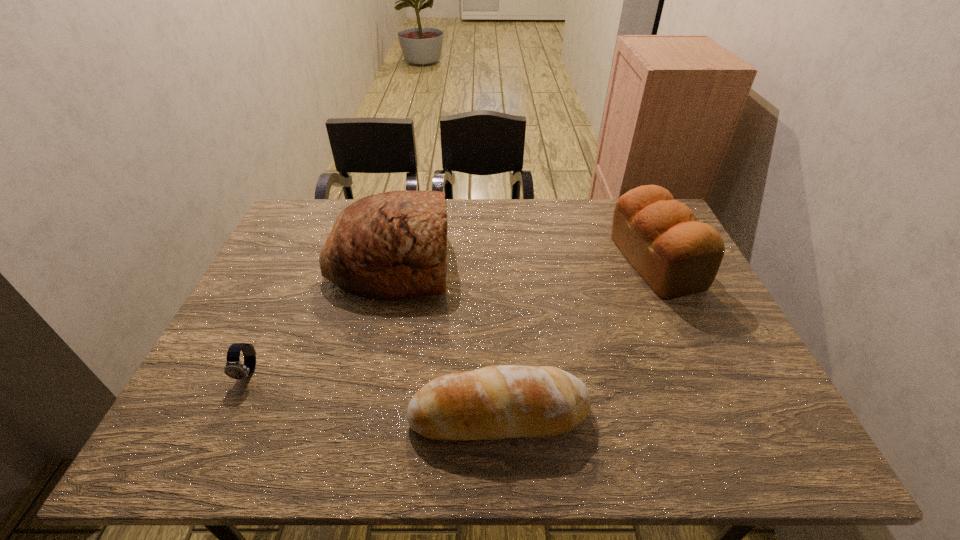
Where is `the rightmost bread`? This screenshot has height=540, width=960. the rightmost bread is located at coordinates (677, 256).

Where is `the second shortest object`? the second shortest object is located at coordinates (497, 402).

Where is `the nearest bread`? The image size is (960, 540). the nearest bread is located at coordinates (497, 402).

Identify the location of the leftmost object. (234, 369).

Locate an element on the screen. the shortest object is located at coordinates (234, 369).

At what (x,y) coordinates should I click in order to perform the action: click on vacant space situated on the front of the rightmost bread. Please return your answer as a coordinate pair (x, y). This screenshot has width=960, height=540. Looking at the image, I should click on (732, 429).

Where is `vacant region located on the back of the nearest bread`? This screenshot has width=960, height=540. vacant region located on the back of the nearest bread is located at coordinates (496, 351).

Where is `free region located 0.110m on the face of the leftmost object`? free region located 0.110m on the face of the leftmost object is located at coordinates (221, 431).

Locate an element on the screen. object that is at the near edge is located at coordinates pyautogui.click(x=497, y=402).

At what (x,y) coordinates should I click in order to perform the action: click on object present at the left edge. Please return your answer as a coordinate pair (x, y). This screenshot has width=960, height=540. Looking at the image, I should click on (234, 369).